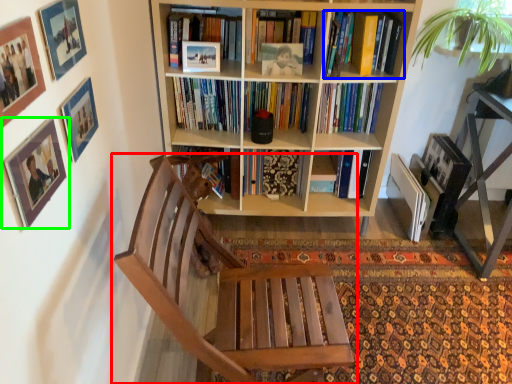
Question: Estimate the real-world distances between objects in this image. Which object is farther from chair (highlighted by a red box), book (highlighted by a blue box) or picture frame (highlighted by a green box)?

Choices:
 (A) book
 (B) picture frame

Answer: (A)